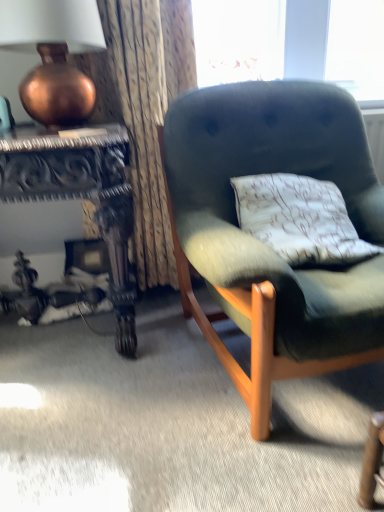
Identify the location of velvet green armchair at center. (263, 244).

Image resolution: width=384 pixels, height=512 pixels. Find the location of `textured fabric curtain at upper left`. textured fabric curtain at upper left is located at coordinates (145, 110).

This screenshot has height=512, width=384. Find the location of `copper metallic vase at upper left`. copper metallic vase at upper left is located at coordinates click(x=53, y=52).

Where is `carved wood desk at left`? The image size is (384, 512). carved wood desk at left is located at coordinates (80, 194).

Measure the distance between point (x=113, y=192) and camera.

Point (x=113, y=192) is 1.21 meters away from camera.

Where is `velvet green armchair at center`? velvet green armchair at center is located at coordinates (263, 244).

Can you confirm if copper metallic vase at upper left is thinner than textured fabric curtain at upper left?

In fact, copper metallic vase at upper left might be wider than textured fabric curtain at upper left.

Who is smaller, copper metallic vase at upper left or textured fabric curtain at upper left?

With smaller size is copper metallic vase at upper left.

Is copper metallic vase at upper left outside of textured fabric curtain at upper left?

No.

Based on their positions, is carved wood desk at left located to the left or right of textured fabric curtain at upper left?

In the image, carved wood desk at left appears on the left side of textured fabric curtain at upper left.

You are a GUI agent. You are given a task and a screenshot of the screen. Output one action in this format:
    pyautogui.click(x=<x>, y=<y>)
    Task: Click on the desk in front of the textured fabric curtain at upper left
    This screenshot has height=512, width=384.
    Given the screenshot: What is the action you would take?
    (80, 194)

Which point is more forward, (95, 201) or (181, 76)?

→ The point (95, 201) is closer.

Is carved wood desk at left positioned with its back to textured fabric curtain at upper left?

carved wood desk at left does not have its back to textured fabric curtain at upper left.

From a real-world perspective, who is located lower, textured fabric curtain at upper left or copper metallic vase at upper left?

In real-world perspective, textured fabric curtain at upper left is lower.

Does textured fabric curtain at upper left have a lesser height compared to copper metallic vase at upper left?

No, textured fabric curtain at upper left is not shorter than copper metallic vase at upper left.

Is textured fabric curtain at upper left far from copper metallic vase at upper left?

That's not correct — textured fabric curtain at upper left is a little close to copper metallic vase at upper left.

From the picture: Is textured fabric curtain at upper left facing towards copper metallic vase at upper left?

Yes, textured fabric curtain at upper left is oriented towards copper metallic vase at upper left.

I want to click on curtain that is above the velvet green armchair at center (from the image's perspective), so click(x=145, y=110).

Can you confirm if textured fabric curtain at upper left is bigger than velvet green armchair at center?

Actually, textured fabric curtain at upper left might be smaller than velvet green armchair at center.

Consider the image. From a real-world perspective, is textured fabric curtain at upper left physically below velvet green armchair at center?

Actually, textured fabric curtain at upper left is physically above velvet green armchair at center in the real world.

Considering the relative positions of textured fabric curtain at upper left and velvet green armchair at center in the image provided, is textured fabric curtain at upper left to the left of velvet green armchair at center from the viewer's perspective?

Yes, textured fabric curtain at upper left is to the left of velvet green armchair at center.

Is point (98, 44) closer to camera compared to point (112, 251)?

Yes, point (98, 44) is closer to viewer.

Based on the photo, does copper metallic vase at upper left have a larger size compared to carved wood desk at left?

No.

From a real-world perspective, is copper metallic vase at upper left physically below carved wood desk at left?

No, from a real-world perspective, copper metallic vase at upper left is not beneath carved wood desk at left.

Could you tell me if copper metallic vase at upper left is turned towards velvet green armchair at center?

No, copper metallic vase at upper left does not turn towards velvet green armchair at center.

From a real-world perspective, is copper metallic vase at upper left located beneath velvet green armchair at center?

No, from a real-world perspective, copper metallic vase at upper left is not below velvet green armchair at center.

From the image's perspective, between copper metallic vase at upper left and velvet green armchair at center, which one is located above?

copper metallic vase at upper left, from the image's perspective.

Who is shorter, copper metallic vase at upper left or velvet green armchair at center?

Standing shorter between the two is copper metallic vase at upper left.

Considering the relative positions of velvet green armchair at center and textured fabric curtain at upper left in the image provided, is velvet green armchair at center to the right of textured fabric curtain at upper left from the viewer's perspective?

Indeed, velvet green armchair at center is positioned on the right side of textured fabric curtain at upper left.

Can you confirm if velvet green armchair at center is bigger than textured fabric curtain at upper left?

Correct, velvet green armchair at center is larger in size than textured fabric curtain at upper left.

Looking at this image, from the image's perspective, would you say velvet green armchair at center is positioned over textured fabric curtain at upper left?

Incorrect, from the image's perspective, velvet green armchair at center is lower than textured fabric curtain at upper left.

From a real-world perspective, is velvet green armchair at center positioned over textured fabric curtain at upper left based on gravity?

No, from a real-world perspective, velvet green armchair at center is not on top of textured fabric curtain at upper left.

Find the location of a particular element. lamp above the textured fabric curtain at upper left (from the image's perspective) is located at coordinates (53, 52).

Where is `curtain that appears behind the carved wood desk at left`? The image size is (384, 512). curtain that appears behind the carved wood desk at left is located at coordinates (145, 110).

When comparing their distances from copper metallic vase at upper left, does velvet green armchair at center or carved wood desk at left seem further?

The object further to copper metallic vase at upper left is velvet green armchair at center.

Considering their positions, is velvet green armchair at center positioned further to copper metallic vase at upper left than textured fabric curtain at upper left?

velvet green armchair at center.

Looking at the image, which one is located further to velvet green armchair at center, carved wood desk at left or copper metallic vase at upper left?

copper metallic vase at upper left lies further to velvet green armchair at center than the other object.

From the image, which object appears to be farther from copper metallic vase at upper left, textured fabric curtain at upper left or carved wood desk at left?

Based on the image, carved wood desk at left appears to be further to copper metallic vase at upper left.

Looking at the image, which one is located closer to carved wood desk at left, velvet green armchair at center or textured fabric curtain at upper left?

Among the two, textured fabric curtain at upper left is located nearer to carved wood desk at left.

Looking at the image, which one is located closer to textured fabric curtain at upper left, copper metallic vase at upper left or carved wood desk at left?

Based on the image, copper metallic vase at upper left appears to be nearer to textured fabric curtain at upper left.

Looking at the image, which one is located closer to copper metallic vase at upper left, textured fabric curtain at upper left or velvet green armchair at center?

textured fabric curtain at upper left is positioned closer to the anchor copper metallic vase at upper left.

Consider the image. Which object lies nearer to the anchor point textured fabric curtain at upper left, carved wood desk at left or velvet green armchair at center?

carved wood desk at left is closer to textured fabric curtain at upper left.

Where is `lamp located between carved wood desk at left and velvet green armchair at center in the left-right direction`? This screenshot has height=512, width=384. lamp located between carved wood desk at left and velvet green armchair at center in the left-right direction is located at coordinates (53, 52).

Where is `curtain between copper metallic vase at upper left and velvet green armchair at center from left to right`? curtain between copper metallic vase at upper left and velvet green armchair at center from left to right is located at coordinates (145, 110).

At what (x,y) coordinates should I click in order to perform the action: click on curtain that lies between copper metallic vase at upper left and carved wood desk at left from top to bottom. Please return your answer as a coordinate pair (x, y). The image size is (384, 512). Looking at the image, I should click on (145, 110).

I want to click on curtain situated between carved wood desk at left and velvet green armchair at center from left to right, so click(x=145, y=110).